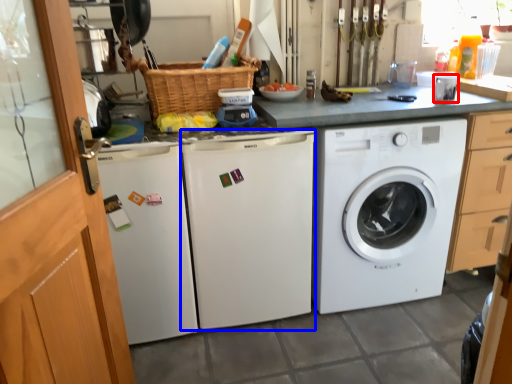
Question: Which point is closer to the camera, appliance (highlighted by a red box) or washing machine (highlighted by a blue box)?

Choices:
 (A) appliance
 (B) washing machine

Answer: (B)